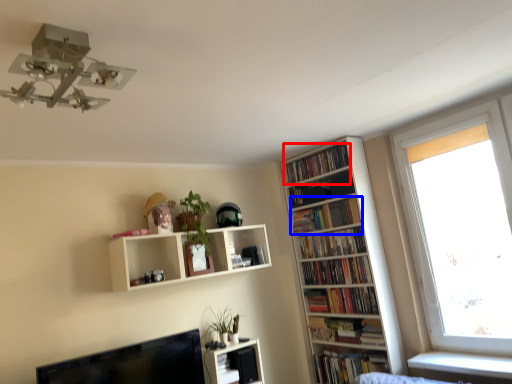
Question: Which object appears farthest to the camera in this image, book (highlighted by a red box) or book (highlighted by a blue box)?

Choices:
 (A) book
 (B) book

Answer: (A)